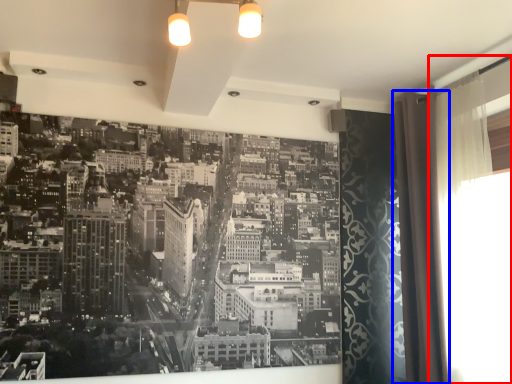
Question: Which object appears farthest to the camera in this image, window screen (highlighted by a red box) or shower curtain (highlighted by a blue box)?

Choices:
 (A) window screen
 (B) shower curtain

Answer: (B)